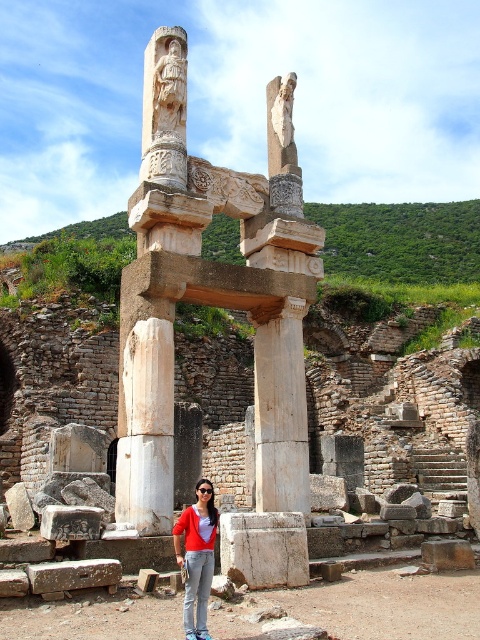
You are standing at the archaeological site and want to take a photo of the white stone column at center. If your camera has a maximum zoom range of 20 meters, will you need to move closer to capture the column in focus?

The white stone column at center is 33.49 meters away from you, which exceeds the camera maximum zoom range of 20 meters. You will need to move closer to capture the column in focus.

You are an archaeologist standing at the archaeological site. You see the white stone column at center and the matte red sweater at center. Which object is wider?

The white stone column at center is wider than the matte red sweater at center.